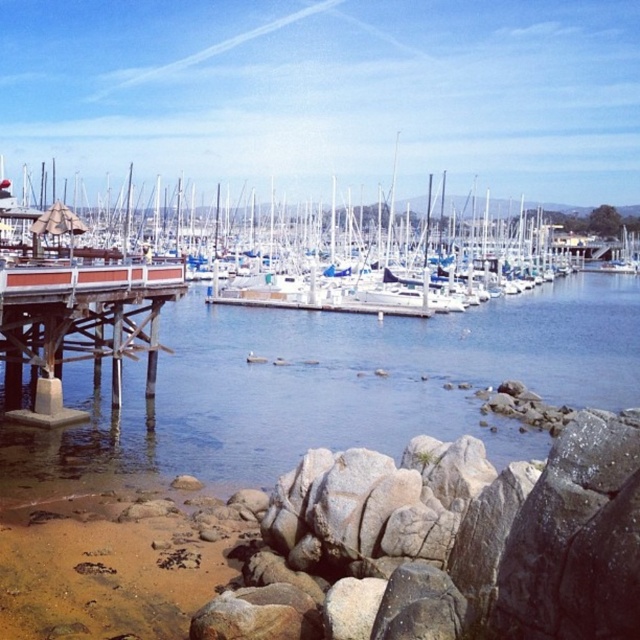
Question: Is clear water at lower left to the left of brown wooden dock at lower left from the viewer's perspective?

Choices:
 (A) no
 (B) yes

Answer: (A)

Question: Which of the following is the farthest from the observer?

Choices:
 (A) brown wooden dock at lower left
 (B) clear water at lower left
 (C) white matte dock at left

Answer: (C)

Question: Which object is the closest to the clear water at lower left?

Choices:
 (A) brown wooden dock at lower left
 (B) white matte dock at left

Answer: (A)

Question: Is clear water at lower left thinner than white matte dock at left?

Choices:
 (A) yes
 (B) no

Answer: (A)

Question: Which point appears farthest from the camera in this image?

Choices:
 (A) (120, 264)
 (B) (378, 307)
 (C) (8, 461)

Answer: (B)

Question: Does clear water at lower left have a larger size compared to white matte dock at left?

Choices:
 (A) yes
 (B) no

Answer: (B)